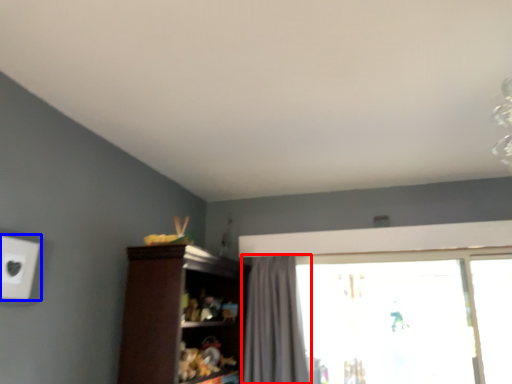
Question: Which object is further to the camera taking this photo, curtain (highlighted by a red box) or electric outlet (highlighted by a blue box)?

Choices:
 (A) curtain
 (B) electric outlet

Answer: (A)